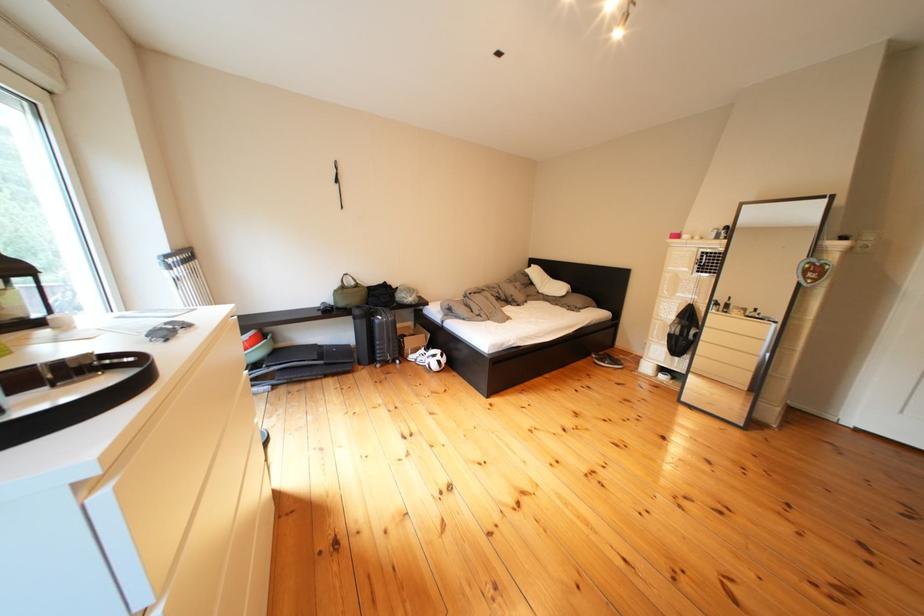
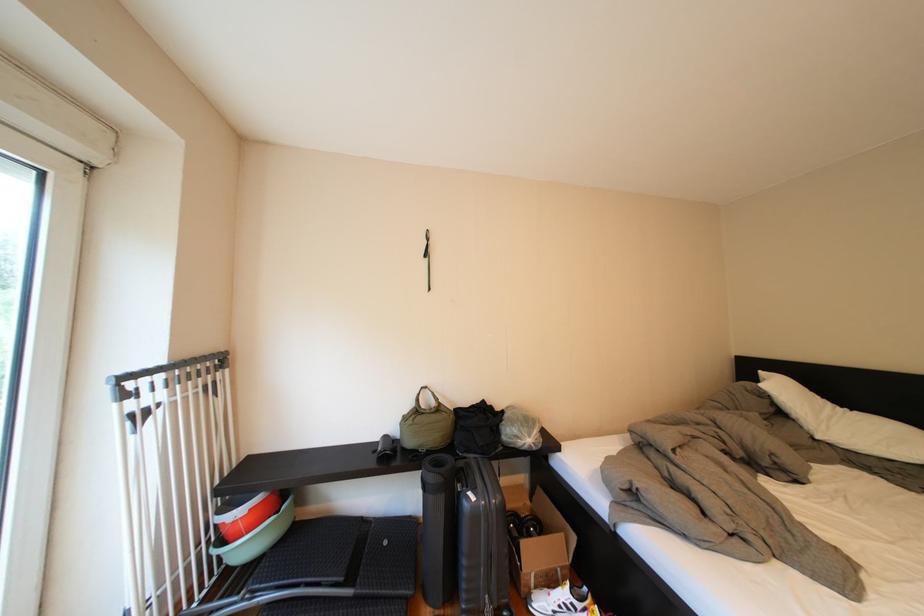
Locate, in the second image, the point that corresponds to (200,261) in the first image.

(224, 369)